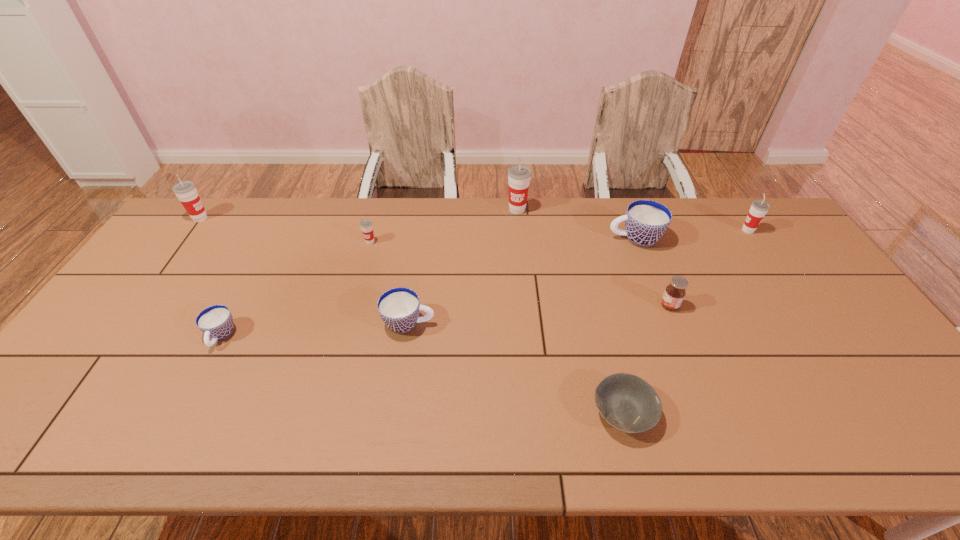
In the image, there is a desktop. Identify the location of vacant space at the far left corner. This screenshot has width=960, height=540. (215, 223).

Where is `free space at the near left corner`? free space at the near left corner is located at coordinates (39, 433).

In the image, there is a desktop. Where is `vacant region at the far right corner`? The width and height of the screenshot is (960, 540). vacant region at the far right corner is located at coordinates (754, 239).

This screenshot has width=960, height=540. What are the coordinates of `empty space that is in between the second cup from left to right and the jam` in the screenshot? It's located at (445, 321).

Where is `free space that is in between the leftmost cup and the tallest object`? This screenshot has width=960, height=540. free space that is in between the leftmost cup and the tallest object is located at coordinates (x=359, y=214).

What are the coordinates of `empty space between the jam and the leftmost blue cup` in the screenshot? It's located at (445, 321).

At what (x,y) coordinates should I click in order to perform the action: click on vacant area that lies between the fourth object from left to right and the shortest cup. Please return your answer as a coordinate pair (x, y). Image resolution: width=960 pixels, height=540 pixels. Looking at the image, I should click on [315, 330].

Locate an element on the screen. Image resolution: width=960 pixels, height=540 pixels. empty location between the third object from left to right and the second tallest cup is located at coordinates (285, 230).

Image resolution: width=960 pixels, height=540 pixels. I want to click on vacant area between the biggest red cup and the nearest red cup, so click(444, 226).

The height and width of the screenshot is (540, 960). Find the location of `free spot between the tallest cup and the second red cup from left to right`. free spot between the tallest cup and the second red cup from left to right is located at coordinates (444, 226).